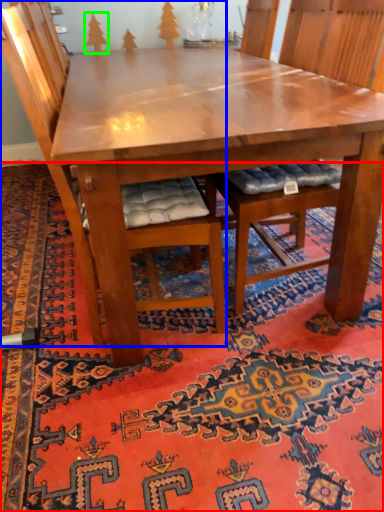
Question: Which object is the closest to the mat (highlighted by a red box)? Choose among these: chair (highlighted by a blue box) or tree (highlighted by a green box).

Choices:
 (A) chair
 (B) tree

Answer: (A)